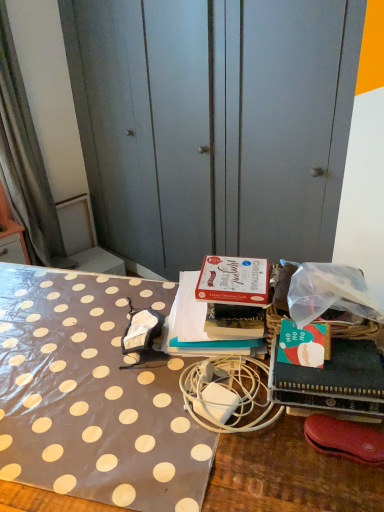
Where is `vacant area that is in front of white matte charger at center`? The height and width of the screenshot is (512, 384). vacant area that is in front of white matte charger at center is located at coordinates (226, 470).